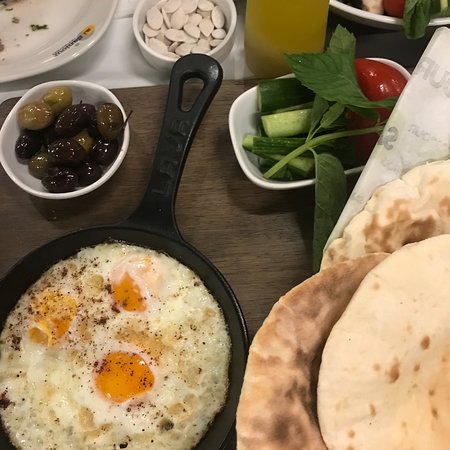
Where is `bowl`? The height and width of the screenshot is (450, 450). bowl is located at coordinates (157, 57).